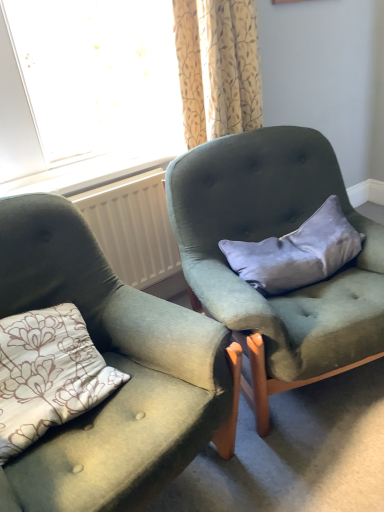
Question: From a real-world perspective, is velvet gray pillow at center on white plastic radiator at center?

Choices:
 (A) yes
 (B) no

Answer: (A)

Question: Is velvet gray pillow at center further to camera compared to white plastic radiator at center?

Choices:
 (A) no
 (B) yes

Answer: (A)

Question: From a real-world perspective, is velvet gray pillow at center physically below white plastic radiator at center?

Choices:
 (A) yes
 (B) no

Answer: (B)

Question: Is velvet gray pillow at center at the right side of white plastic radiator at center?

Choices:
 (A) yes
 (B) no

Answer: (A)

Question: Would you say velvet gray pillow at center is outside white plastic radiator at center?

Choices:
 (A) yes
 (B) no

Answer: (A)

Question: Would you say velvet gray pillow at center is a long distance from white plastic radiator at center?

Choices:
 (A) yes
 (B) no

Answer: (B)

Question: From a real-world perspective, is velvet gray pillow at center located beneath velvet green armchair at center, which is the 2th chair in right-to-left order?

Choices:
 (A) no
 (B) yes

Answer: (A)

Question: Is there a large distance between velvet gray pillow at center and velvet green armchair at center, which is the 2th chair in right-to-left order?

Choices:
 (A) no
 (B) yes

Answer: (A)

Question: From the image's perspective, would you say velvet gray pillow at center is positioned over velvet green armchair at center, which is the 2th chair in right-to-left order?

Choices:
 (A) no
 (B) yes

Answer: (B)

Question: Is velvet gray pillow at center facing towards velvet green armchair at center, which is the 2th chair in right-to-left order?

Choices:
 (A) no
 (B) yes

Answer: (A)

Question: From a real-world perspective, is velvet gray pillow at center over velvet green armchair at center, acting as the 1th chair starting from the left?

Choices:
 (A) no
 (B) yes

Answer: (B)

Question: Is velvet gray pillow at center taller than velvet green armchair at center, acting as the 1th chair starting from the left?

Choices:
 (A) no
 (B) yes

Answer: (A)

Question: Does white plastic radiator at center have a larger size compared to velvet gray pillow at center?

Choices:
 (A) no
 (B) yes

Answer: (A)